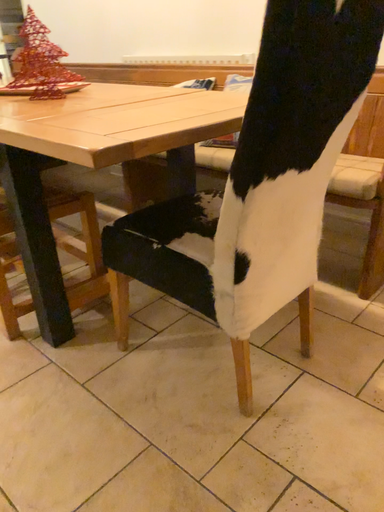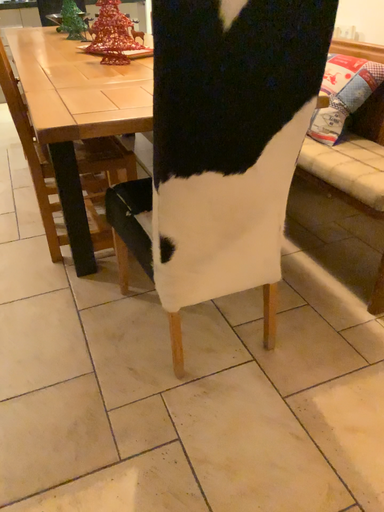
Question: How did the camera likely rotate when shooting the video?

Choices:
 (A) rotated right
 (B) rotated left

Answer: (B)